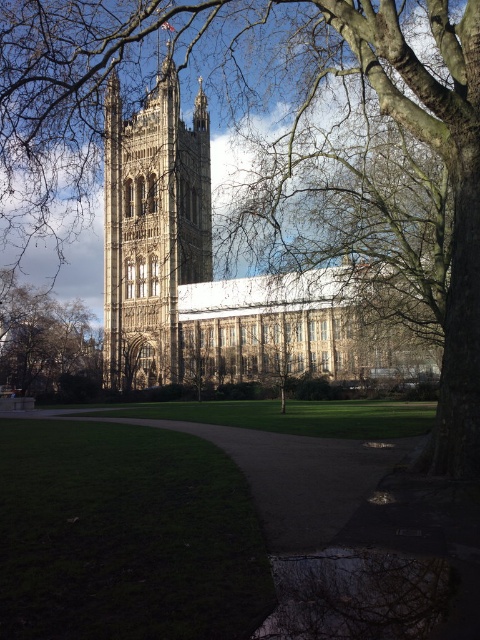
You are standing in front of the historic building and want to take a photo of both the point at coordinates (x=115, y=122) and the point at coordinates (x=192, y=216). Which point will appear closer to the camera in your photo?

The point at coordinates (x=115, y=122) will appear closer to the camera because it is further to the camera than the point at coordinates (x=192, y=216).

In the scene shown: You are a tourist standing at the entrance of the historic building and want to reach the brown gravel path at center. According to the map, your current position is at point 0.744, 0.615. Which direction should you walk to reach the path?

The brown gravel path at center is located at point (x=295, y=476), so you are already at the path.